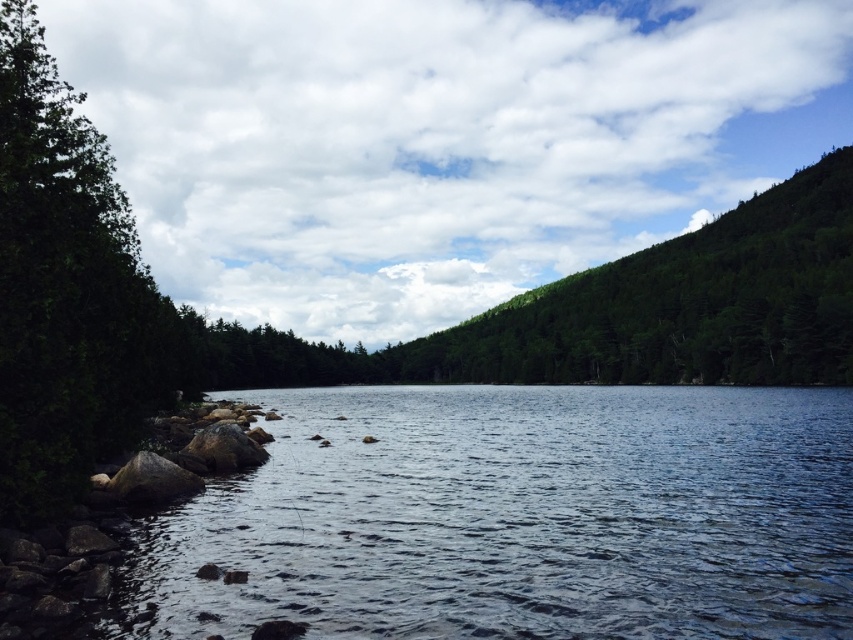
Question: Which object is farther from the camera taking this photo?

Choices:
 (A) dark blue water at lower left
 (B) green leafy tree at left

Answer: (B)

Question: Does dark blue water at lower left appear under green leafy tree at left?

Choices:
 (A) no
 (B) yes

Answer: (B)

Question: Which point is closer to the camera?

Choices:
 (A) green leafy tree at left
 (B) dark blue water at lower left

Answer: (B)

Question: Which point appears closest to the camera in this image?

Choices:
 (A) (115, 193)
 (B) (590, 579)

Answer: (B)

Question: Is the position of dark blue water at lower left more distant than that of green leafy tree at left?

Choices:
 (A) yes
 (B) no

Answer: (B)

Question: Can you confirm if dark blue water at lower left is positioned below green leafy tree at left?

Choices:
 (A) yes
 (B) no

Answer: (A)